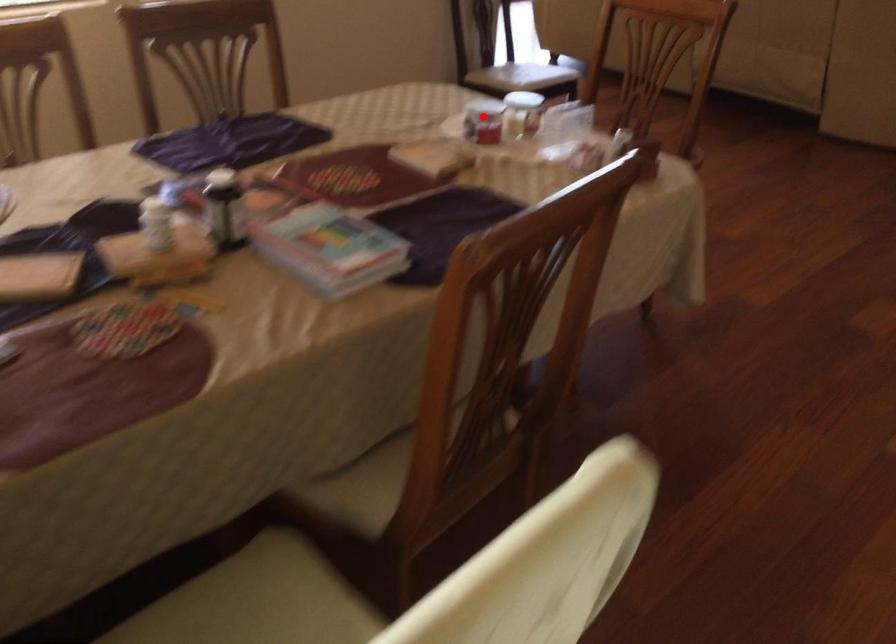
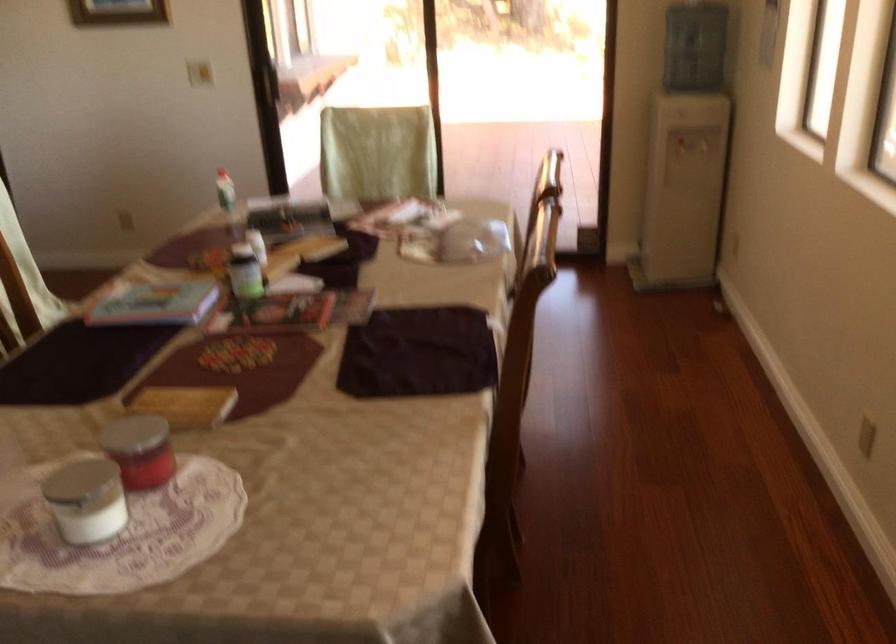
Where in the second image is the point corresponding to the highlighted location from the first image?

(149, 458)